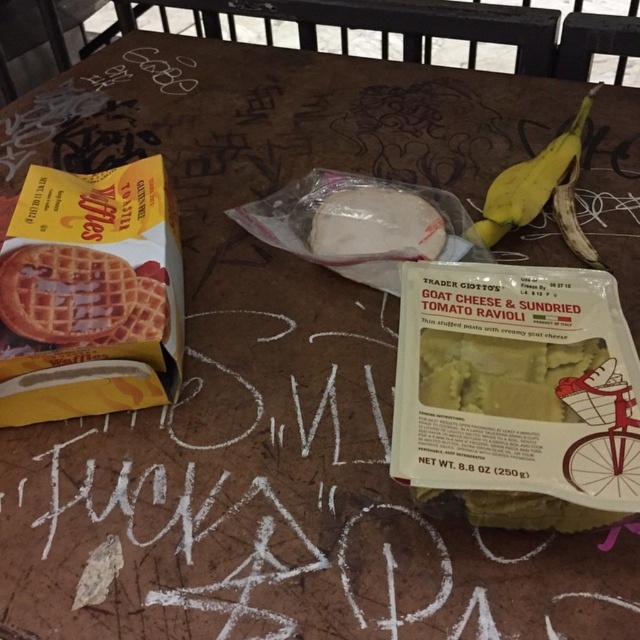
Question: Considering the real-world distances, which object is farthest from the white matte ravioli at center?

Choices:
 (A) yellow matte waffles at upper left
 (B) golden brown waffle at left

Answer: (B)

Question: Which point is farther to the camera?

Choices:
 (A) (346, 257)
 (B) (115, 330)

Answer: (A)

Question: Is yellow matte waffles at upper left below white matte ravioli at center?

Choices:
 (A) no
 (B) yes

Answer: (B)

Question: Is yellow matte waffles at upper left below golden brown waffle at left?

Choices:
 (A) yes
 (B) no

Answer: (B)

Question: Which point is closer to the camera?

Choices:
 (A) (154, 400)
 (B) (563, 160)
 (C) (403, 198)

Answer: (A)

Question: Can you confirm if yellow matte waffles at upper left is smaller than yellow matte banana at upper right?

Choices:
 (A) yes
 (B) no

Answer: (A)